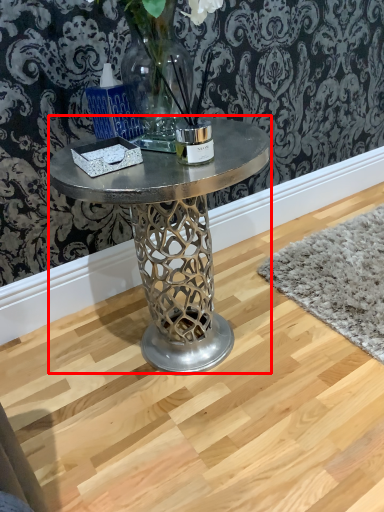
Question: Observing the image, what is the correct spatial positioning of coffee table (annotated by the red box) in reference to candle holder?

Choices:
 (A) right
 (B) left

Answer: (A)